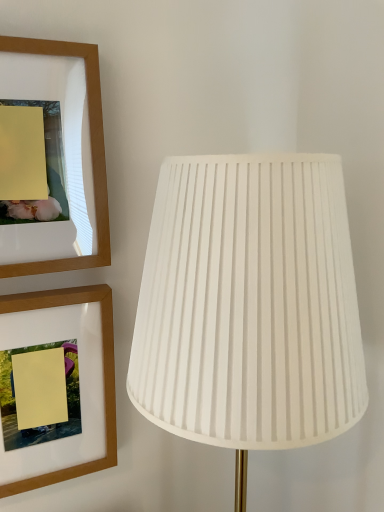
Question: Is wooden picture frame at upper left, positioned as the first picture frame in top-to-bottom order, completely or partially outside of white pleated fabric lamp at right?

Choices:
 (A) no
 (B) yes

Answer: (B)

Question: Is wooden picture frame at upper left, positioned as the first picture frame in top-to-bottom order, at the left side of white pleated fabric lamp at right?

Choices:
 (A) no
 (B) yes

Answer: (B)

Question: Is wooden picture frame at upper left, the 2th picture frame positioned from the bottom, next to white pleated fabric lamp at right?

Choices:
 (A) yes
 (B) no

Answer: (B)

Question: Can you confirm if wooden picture frame at upper left, the 2th picture frame positioned from the bottom, is wider than white pleated fabric lamp at right?

Choices:
 (A) no
 (B) yes

Answer: (A)

Question: Is wooden picture frame at upper left, the 2th picture frame positioned from the bottom, far from white pleated fabric lamp at right?

Choices:
 (A) no
 (B) yes

Answer: (A)

Question: Considering the positions of wooden picture frame at upper left, positioned as the first picture frame in top-to-bottom order, and white pleated fabric lamp at right in the image, is wooden picture frame at upper left, positioned as the first picture frame in top-to-bottom order, wider or thinner than white pleated fabric lamp at right?

Choices:
 (A) thin
 (B) wide

Answer: (A)

Question: From the image's perspective, is wooden picture frame at upper left, the 2th picture frame positioned from the bottom, above or below white pleated fabric lamp at right?

Choices:
 (A) above
 (B) below

Answer: (A)

Question: Is wooden picture frame at upper left, positioned as the first picture frame in top-to-bottom order, inside the boundaries of white pleated fabric lamp at right, or outside?

Choices:
 (A) outside
 (B) inside

Answer: (A)

Question: In terms of height, does wooden picture frame at upper left, positioned as the first picture frame in top-to-bottom order, look taller or shorter compared to white pleated fabric lamp at right?

Choices:
 (A) tall
 (B) short

Answer: (B)

Question: Choose the correct answer: Is wooden picture frame at upper left, which is the first picture frame in bottom-to-top order, inside wooden picture frame at upper left, the 2th picture frame positioned from the bottom, or outside it?

Choices:
 (A) inside
 (B) outside

Answer: (B)

Question: From the image's perspective, is wooden picture frame at upper left, which is the first picture frame in bottom-to-top order, located above or below wooden picture frame at upper left, the 2th picture frame positioned from the bottom?

Choices:
 (A) above
 (B) below

Answer: (B)

Question: Looking at their shapes, would you say wooden picture frame at upper left, which is the first picture frame in bottom-to-top order, is wider or thinner than wooden picture frame at upper left, the 2th picture frame positioned from the bottom?

Choices:
 (A) thin
 (B) wide

Answer: (B)

Question: In terms of size, does wooden picture frame at upper left, which is the second picture frame from top to bottom, appear bigger or smaller than wooden picture frame at upper left, positioned as the first picture frame in top-to-bottom order?

Choices:
 (A) big
 (B) small

Answer: (A)

Question: Would you say wooden picture frame at upper left, positioned as the first picture frame in top-to-bottom order, is inside or outside wooden picture frame at upper left, which is the first picture frame in bottom-to-top order?

Choices:
 (A) outside
 (B) inside

Answer: (A)

Question: In terms of width, does wooden picture frame at upper left, the 2th picture frame positioned from the bottom, look wider or thinner when compared to wooden picture frame at upper left, which is the first picture frame in bottom-to-top order?

Choices:
 (A) wide
 (B) thin

Answer: (B)